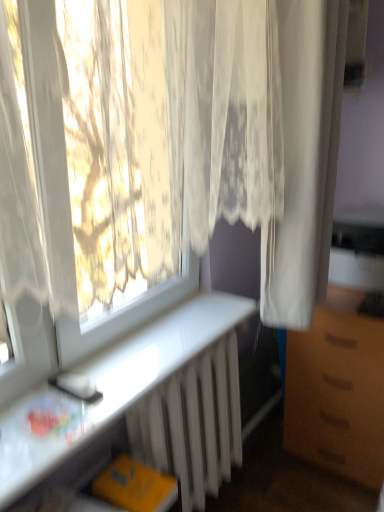
In order to click on free space above white glossy desk at lower left (from a real-world perspective) in this screenshot , I will do `click(120, 365)`.